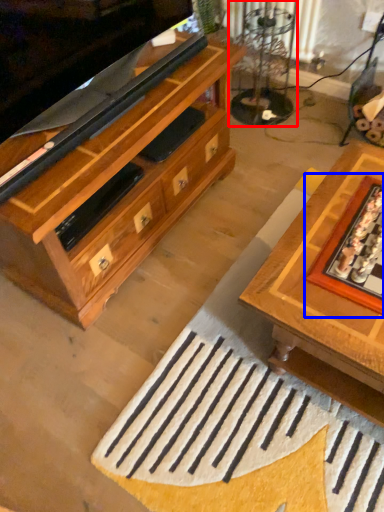
Question: Which of the following is the farthest to the observer, glass table (highlighted by a red box) or board game (highlighted by a blue box)?

Choices:
 (A) glass table
 (B) board game

Answer: (A)